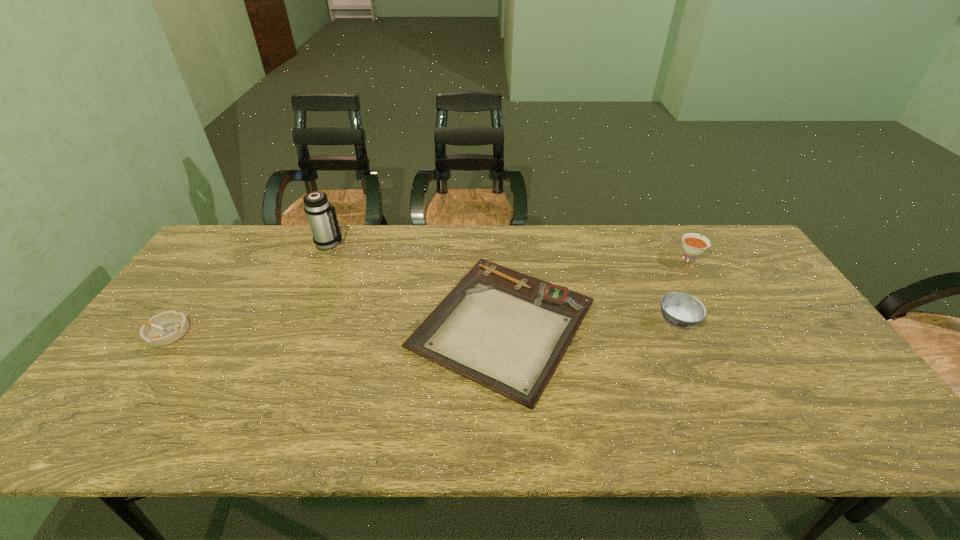
This screenshot has width=960, height=540. Identify the location of empty location between the second object from left to right and the shorter ashtray. (248, 288).

The image size is (960, 540). In order to click on blank region between the clipboard and the second shortest object in this screenshot , I will do `click(334, 328)`.

Identify which object is the fourth closest to the rightmost object. Please provide its 2D coordinates. Your answer should be formatted as a tuple, i.e. [(x, y)], where the tuple contains the x and y coordinates of a point satisfying the conditions above.

[(167, 327)]

Choose which object is the nearest neighbor to the right ashtray. Please provide its 2D coordinates. Your answer should be formatted as a tuple, i.e. [(x, y)], where the tuple contains the x and y coordinates of a point satisfying the conditions above.

[(507, 331)]

Locate an element on the screen. This screenshot has height=540, width=960. free point that satisfies the following two spatial constraints: 1. on the side with the handle of the thermos bottle; 2. on the right side of the third object from left to right is located at coordinates (296, 323).

The image size is (960, 540). I want to click on free spot that satisfies the following two spatial constraints: 1. on the side of the rightmost object with the handle; 2. on the side with the handle of the fourth object from right to left, so click(x=682, y=244).

This screenshot has width=960, height=540. Identify the location of blank space that satisfies the following two spatial constraints: 1. on the side with the handle of the second object from left to right; 2. on the left side of the third shortest object. (298, 320).

Where is `free space that satisfies the following two spatial constraints: 1. on the side of the fourth shortest object with the handle; 2. on the side with the handle of the second object from left to right`? The image size is (960, 540). free space that satisfies the following two spatial constraints: 1. on the side of the fourth shortest object with the handle; 2. on the side with the handle of the second object from left to right is located at coordinates (682, 244).

In order to click on free location that satisfies the following two spatial constraints: 1. on the back side of the shortest object; 2. on the side with the handle of the tallest object in this screenshot , I will do `click(498, 244)`.